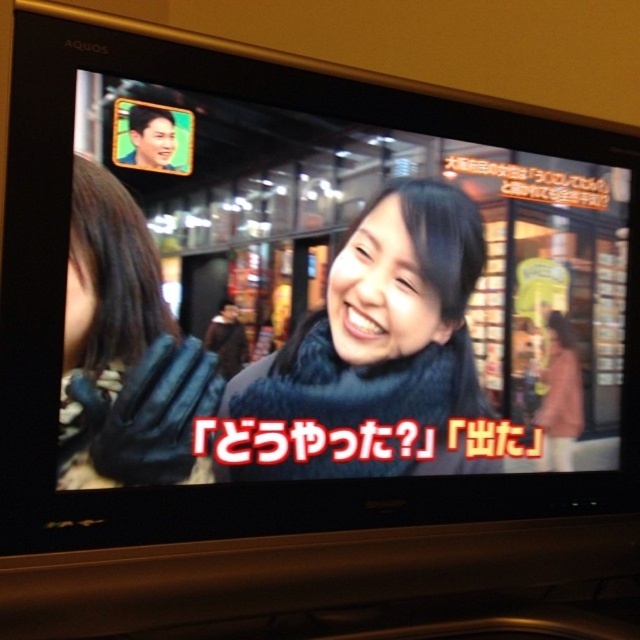
You are a fashion designer observing the TV screen. You notice the blue fuzzy scarf at center and the blue fuzzy gloves at left. Which item is positioned higher on the screen?

The blue fuzzy scarf at center is taller than the blue fuzzy gloves at left, so the scarf is positioned higher on the screen.

You are a fashion designer looking at a TV commercial. You notice the blue fuzzy scarf at center and the blue fuzzy gloves at left. Which accessory is positioned lower on the TV screen?

The blue fuzzy scarf at center is located below the blue fuzzy gloves at left, so the scarf is positioned lower on the TV screen.